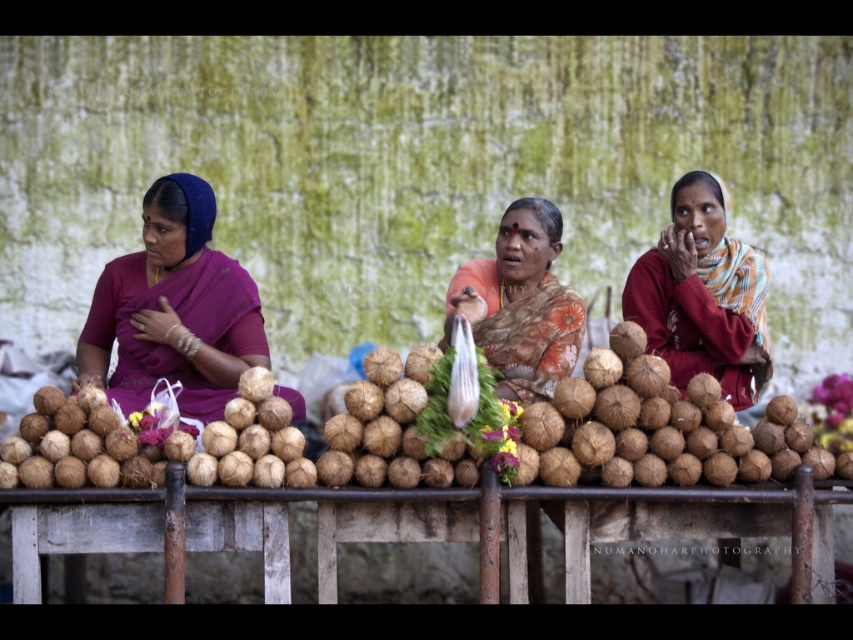
From the picture: You are a customer at the market stall and want to buy the brown rough coconut at center and the matte brown coconut at center. Which one is positioned lower on the table?

The brown rough coconut at center is located below matte brown coconut at center, so the brown rough coconut at center is positioned lower on the table.

You are standing at a distance of 30 meters from the market stall. If you move forward by 0.38 meters, will you be closer to the point at coordinates point (94, 305)?

The distance of point (94, 305) from viewer is 29.62 meters. Moving forward by 0.38 meters would bring you to 29.62 meters minus 0.38 meters equals 29.24 meters, so yes, you will be closer to the point at coordinates point (94, 305).